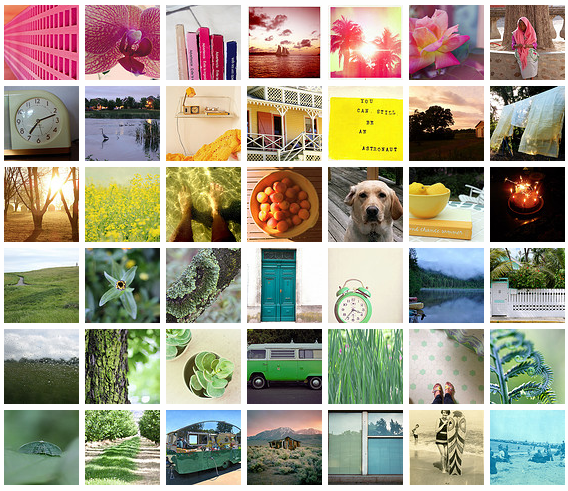
Locate an element on the screen. This screenshot has width=568, height=491. top row of photographs is located at coordinates (44, 38), (127, 43), (206, 44), (283, 45), (361, 49), (441, 48), (523, 47).